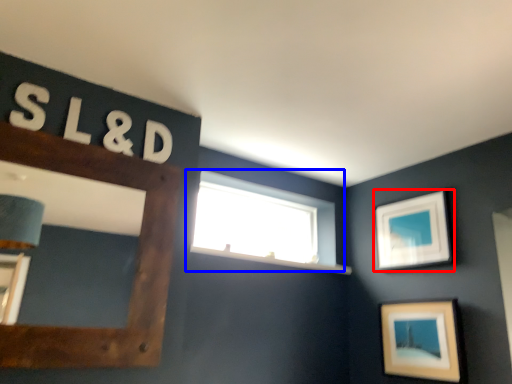
Question: Which point is closer to the camera, picture frame (highlighted by a red box) or window (highlighted by a blue box)?

Choices:
 (A) picture frame
 (B) window

Answer: (A)